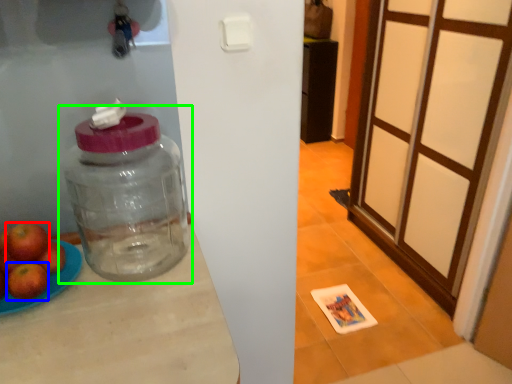
Question: Estimate the real-world distances between objects in this image. Which object is closer to apple (highlighted by a red box), apple (highlighted by a blue box) or bottle (highlighted by a green box)?

Choices:
 (A) apple
 (B) bottle

Answer: (A)